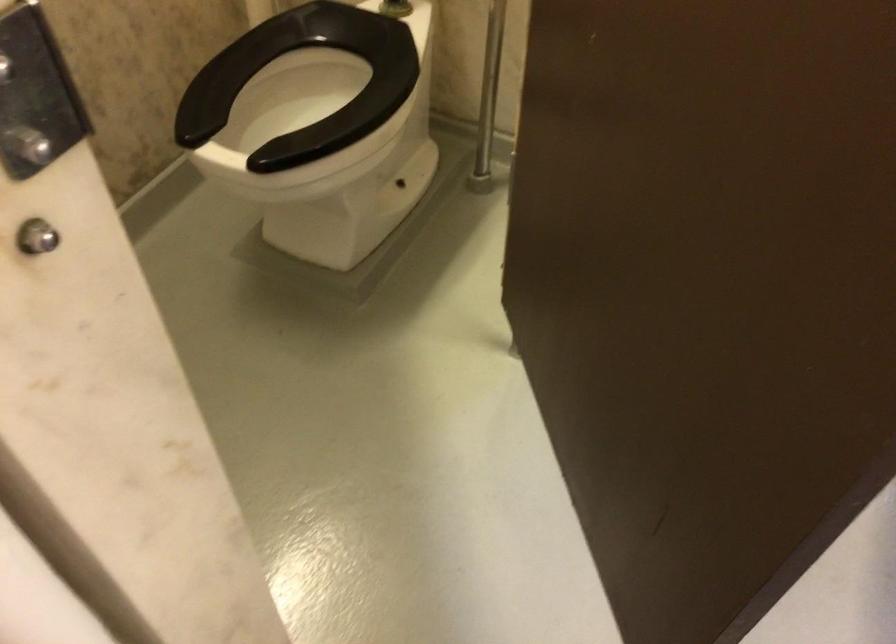
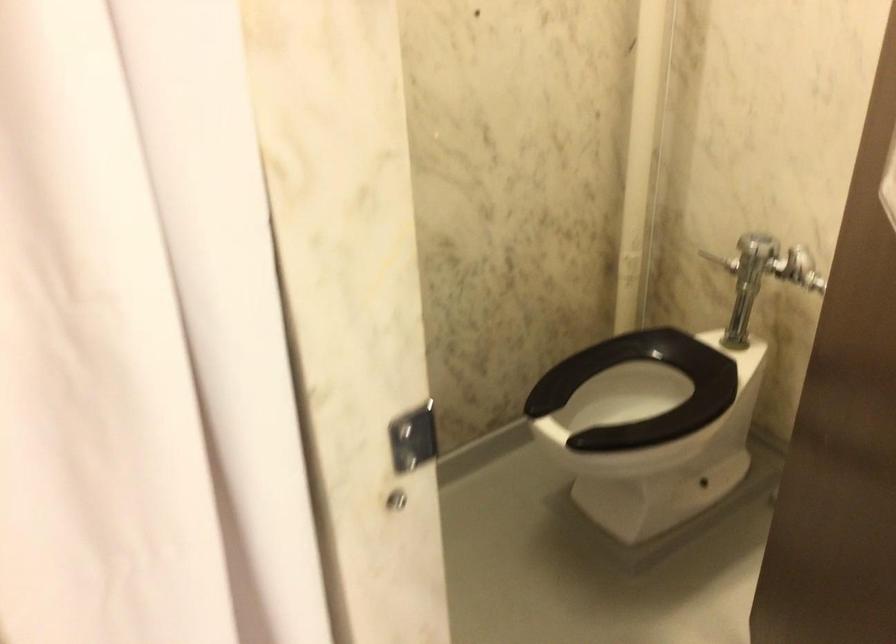
Question: The first image is from the beginning of the video and the second image is from the end. How did the camera likely rotate when shooting the video?

Choices:
 (A) Left
 (B) Right
 (C) Up
 (D) Down

Answer: (A)